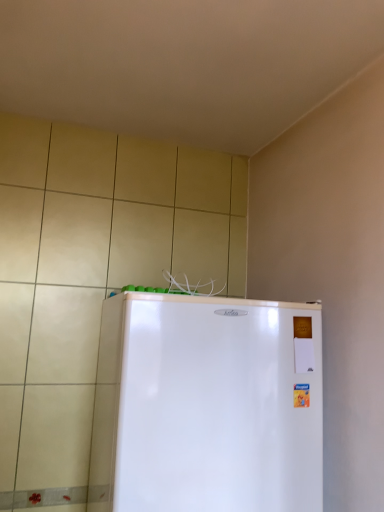
What do you see at coordinates (207, 405) in the screenshot? I see `white glossy refrigerator at lower left` at bounding box center [207, 405].

This screenshot has height=512, width=384. Find the location of `white glossy refrigerator at lower left`. white glossy refrigerator at lower left is located at coordinates (207, 405).

You are a GUI agent. You are given a task and a screenshot of the screen. Output one action in this format:
    pyautogui.click(x=<x>, y=<y>)
    Task: Click on the white glossy refrigerator at lower left
    
    Given the screenshot: What is the action you would take?
    pyautogui.click(x=207, y=405)